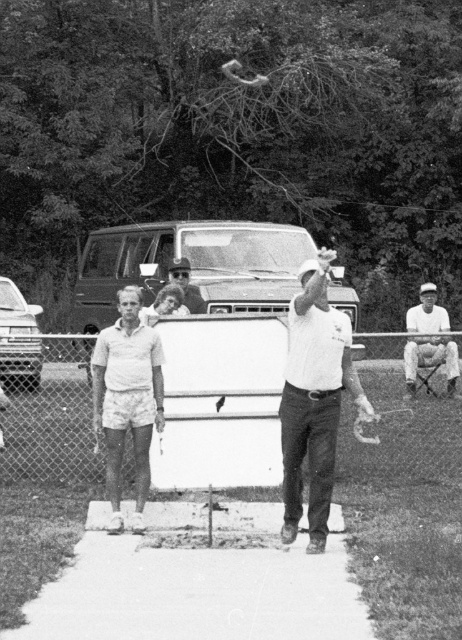
You are standing at the camera position and want to throw a frisbee to the person wearing the white fabric shirt at right. If the frisbee can travel 10 meters, will it reach them?

The white fabric shirt at right is 9.70 meters away from the camera, so yes, the frisbee can reach them since it can travel 10 meters.

You are standing at the starting point of the pathway in the park scene. There are two points marked on the path, one at coordinates point (41,397) and another at point (415,314). Which point is nearer to you?

Point (41,397) is closer to the camera than point (415,314), so the point at coordinates point (41,397) is nearer to you.